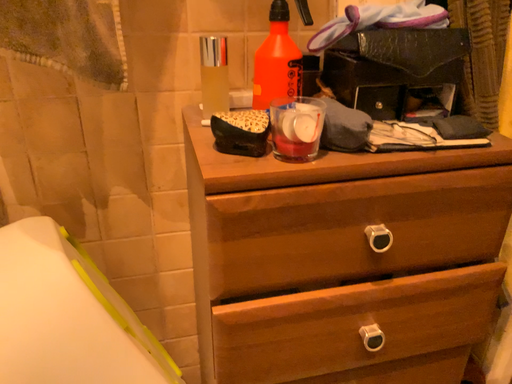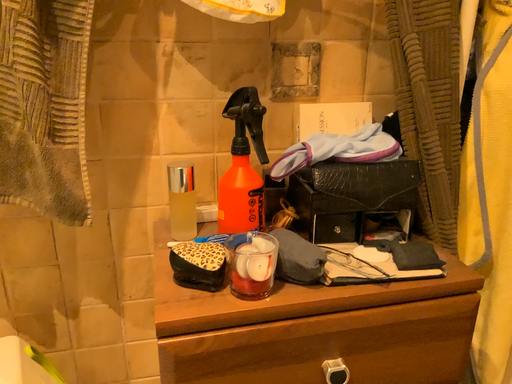
Question: Which way did the camera rotate in the video?

Choices:
 (A) rotated upward
 (B) rotated downward

Answer: (A)